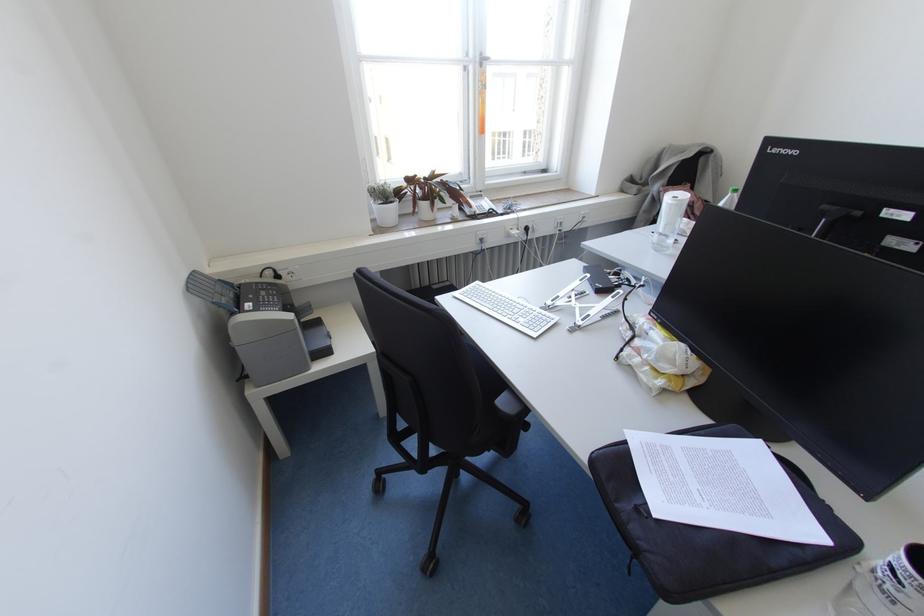
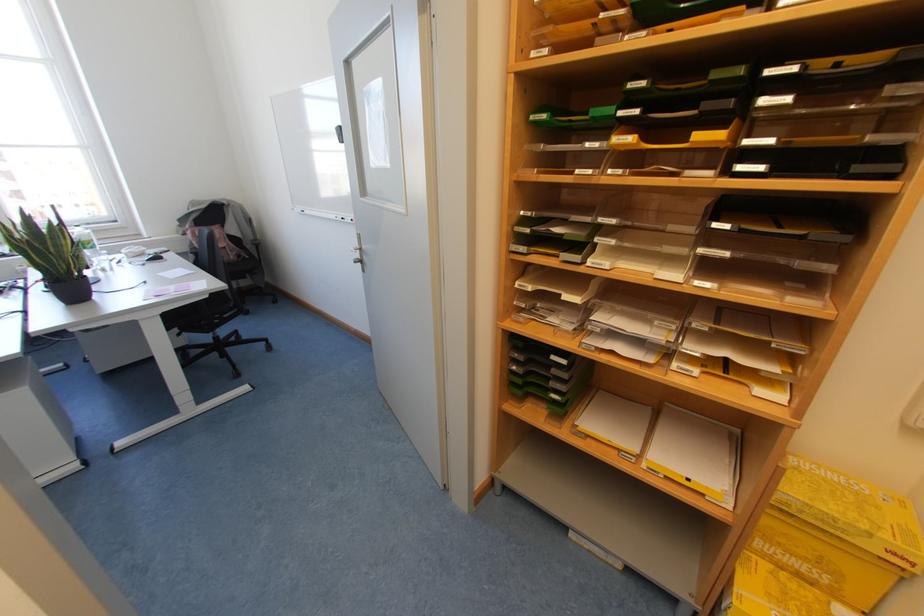
Which direction would the cameraman need to move to produce the second image?

The cameraman walked toward right, backward.